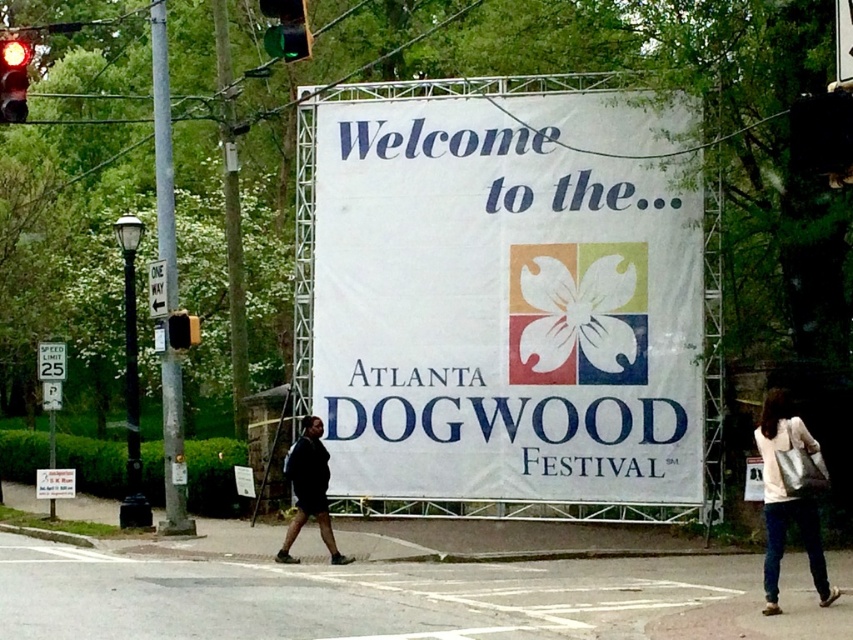
Who is lower down, white leather bag at lower right or red glass traffic light at upper left?

Positioned lower is white leather bag at lower right.

Locate an element on the screen. The image size is (853, 640). white leather bag at lower right is located at coordinates (790, 493).

Does point (813, 506) lie in front of point (7, 60)?

Yes, point (813, 506) is in front of point (7, 60).

Find the location of `white leather bag at lower right`. white leather bag at lower right is located at coordinates (790, 493).

Is dark gray hoodie at center smaller than green plastic one way sign at upper center?

Incorrect, dark gray hoodie at center is not smaller in size than green plastic one way sign at upper center.

Who is more forward, (293,448) or (164,308)?

Positioned in front is point (293,448).

I want to click on dark gray hoodie at center, so click(x=309, y=490).

Between yellow plastic traffic light at left and metallic speed limit sign at center, which one appears on the left side from the viewer's perspective?

Positioned to the left is metallic speed limit sign at center.

Between yellow plastic traffic light at left and metallic speed limit sign at center, which one is positioned lower?

metallic speed limit sign at center is below.

Who is more forward, (x=172, y=333) or (x=39, y=376)?

Point (x=172, y=333) is in front.

Identify the location of yellow plastic traffic light at left. This screenshot has height=640, width=853. (183, 330).